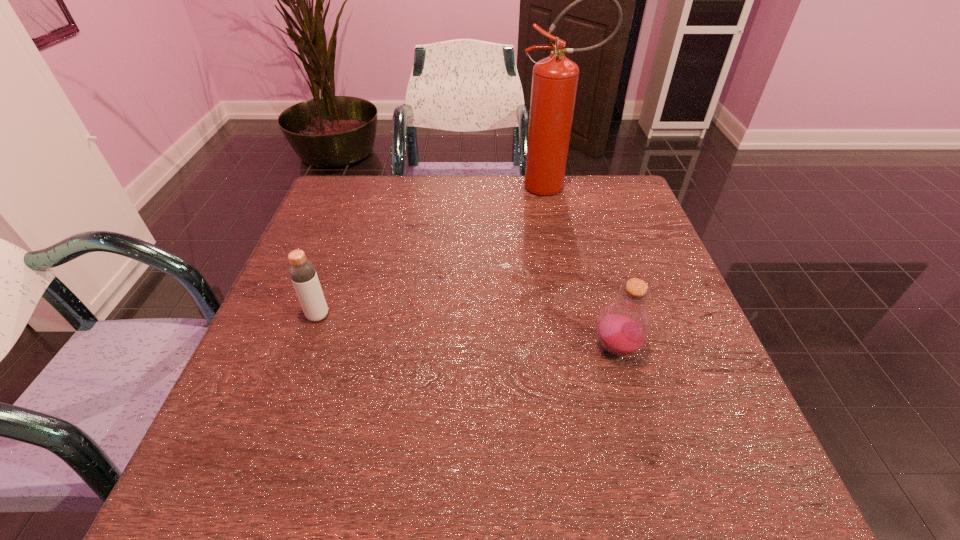
Locate an element on the screen. The image size is (960, 540). vacant area that lies between the fire extinguisher and the left bottle is located at coordinates (436, 251).

The image size is (960, 540). I want to click on free space between the tallest object and the second farthest object, so click(x=436, y=251).

At what (x,y) coordinates should I click in order to perform the action: click on free space between the right bottle and the leftmost object. Please return your answer as a coordinate pair (x, y). The image size is (960, 540). Looking at the image, I should click on (468, 332).

Where is `free space between the nearer bottle and the tallest object`? The width and height of the screenshot is (960, 540). free space between the nearer bottle and the tallest object is located at coordinates (586, 267).

Identify the location of the second closest object to the left bottle. (555, 78).

The width and height of the screenshot is (960, 540). I want to click on object that stands as the closest to the farther bottle, so click(x=624, y=326).

Where is `vacant area in the image that satisfies the following two spatial constraints: 1. from the nozzle of the farthest object; 2. on the front side of the left bottle`? vacant area in the image that satisfies the following two spatial constraints: 1. from the nozzle of the farthest object; 2. on the front side of the left bottle is located at coordinates (583, 315).

Find the location of `free space that satisfies the following two spatial constraints: 1. on the front side of the nearer bottle; 2. on the left side of the second nearest object`. free space that satisfies the following two spatial constraints: 1. on the front side of the nearer bottle; 2. on the left side of the second nearest object is located at coordinates click(x=306, y=348).

This screenshot has width=960, height=540. I want to click on free space that satisfies the following two spatial constraints: 1. from the nozzle of the tallest object; 2. on the right side of the nearest object, so click(590, 348).

You are a GUI agent. You are given a task and a screenshot of the screen. Output one action in this format:
    pyautogui.click(x=<x>, y=<y>)
    Task: Click on the vacant space that satisfies the following two spatial constraints: 1. on the back side of the nearer bottle; 2. from the nozzle of the fire extinguisher
    This screenshot has width=960, height=540.
    Given the screenshot: What is the action you would take?
    pyautogui.click(x=571, y=187)